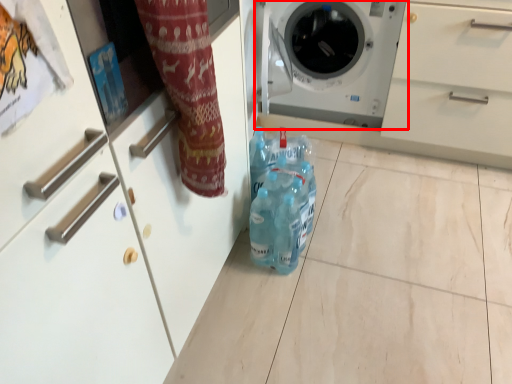
Question: From the image's perspective, where is washing machine (annotated by the red box) located relative to cleaning product?

Choices:
 (A) above
 (B) below

Answer: (A)